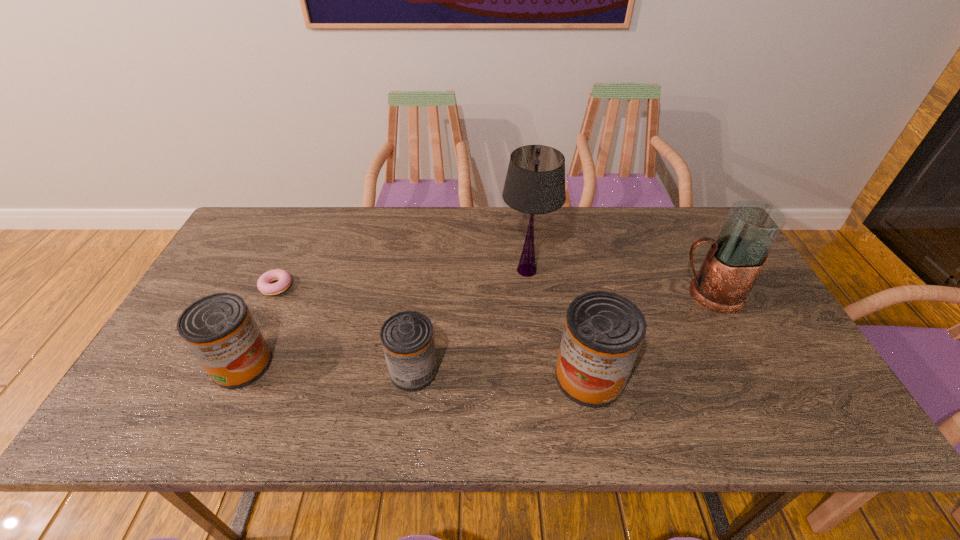
You are a GUI agent. You are given a task and a screenshot of the screen. Output one action in this format:
    pyautogui.click(x=<x>, y=<y>)
    Task: Click on the second shortest can
    This screenshot has width=960, height=540.
    Given the screenshot: What is the action you would take?
    pos(219,329)

Locate an element on the screen. the third shortest object is located at coordinates (219, 329).

I want to click on the second can from left to right, so click(x=407, y=338).

You are a GUI agent. You are given a task and a screenshot of the screen. Output one action in this format:
    pyautogui.click(x=<x>, y=<y>)
    Task: Click on the second shortest object
    This screenshot has height=540, width=960.
    Given the screenshot: What is the action you would take?
    pyautogui.click(x=407, y=338)

You are a GUI agent. You are given a task and a screenshot of the screen. Output one action in this format:
    pyautogui.click(x=<x>, y=<y>)
    Task: Click on the rightmost can
    This screenshot has width=960, height=540.
    Given the screenshot: What is the action you would take?
    pyautogui.click(x=603, y=332)

What are the coordinates of `pitcher` in the screenshot? It's located at 735,259.

Where is `the second tallest object`? the second tallest object is located at coordinates (735, 259).

Where is `the shortest object`? Image resolution: width=960 pixels, height=540 pixels. the shortest object is located at coordinates (263, 284).

Where is `lampshade`? lampshade is located at coordinates (535, 182).

The height and width of the screenshot is (540, 960). I want to click on blank area located 0.210m on the right of the leftmost can, so click(357, 364).